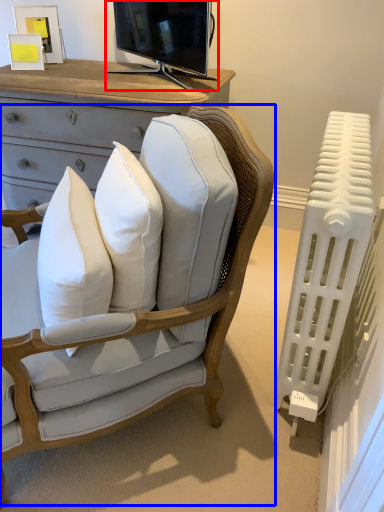
Question: Which of the following is the farthest to the observer, television (highlighted by a red box) or chair (highlighted by a blue box)?

Choices:
 (A) television
 (B) chair

Answer: (A)